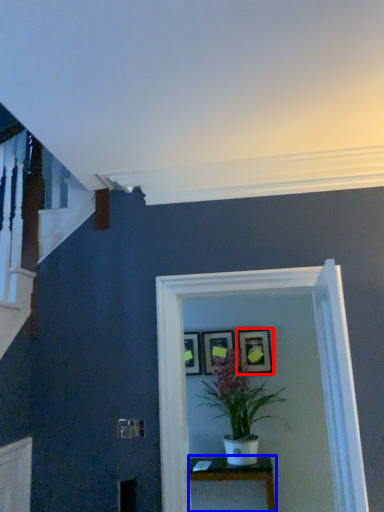
Question: Which point is further to the camera, picture frame (highlighted by a red box) or table (highlighted by a blue box)?

Choices:
 (A) picture frame
 (B) table

Answer: (A)